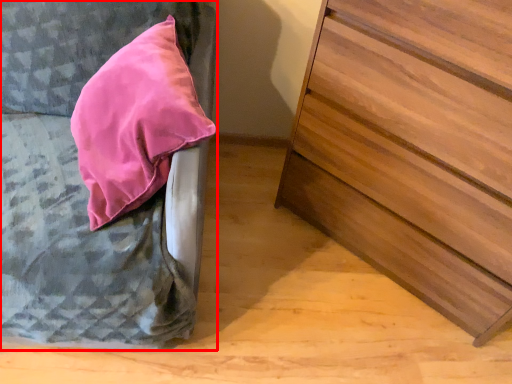
Question: Observing the image, what is the correct spatial positioning of furniture (annotated by the red box) in reference to chest of drawers?

Choices:
 (A) left
 (B) right

Answer: (A)